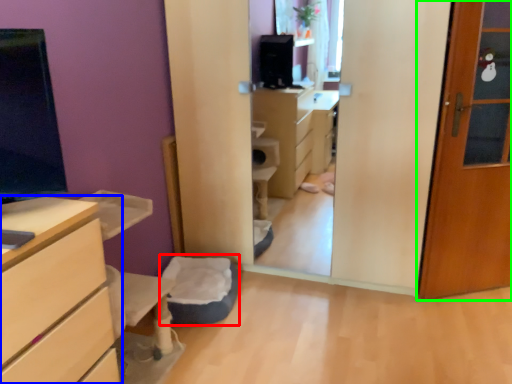
Question: Which is farther away from flat (highlighted by a red box)? chest of drawers (highlighted by a blue box) or door (highlighted by a green box)?

Choices:
 (A) chest of drawers
 (B) door

Answer: (B)